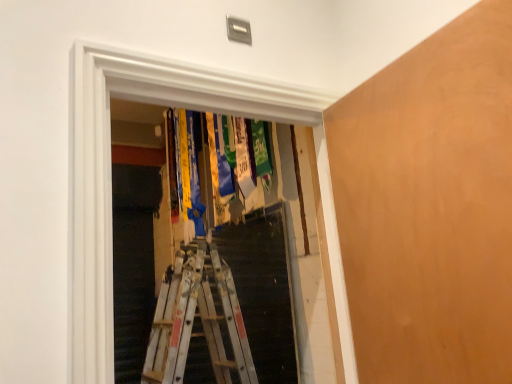
Question: From the image's perspective, is metallic silver ladder at center over transparent plastic medals at center?

Choices:
 (A) no
 (B) yes

Answer: (A)

Question: Is metallic silver ladder at center bigger than transparent plastic medals at center?

Choices:
 (A) no
 (B) yes

Answer: (A)

Question: Is metallic silver ladder at center facing away from transparent plastic medals at center?

Choices:
 (A) yes
 (B) no

Answer: (B)

Question: Does metallic silver ladder at center touch transparent plastic medals at center?

Choices:
 (A) yes
 (B) no

Answer: (B)

Question: From a real-world perspective, is metallic silver ladder at center positioned over transparent plastic medals at center based on gravity?

Choices:
 (A) no
 (B) yes

Answer: (A)

Question: Is metallic silver ladder at center oriented towards transparent plastic medals at center?

Choices:
 (A) yes
 (B) no

Answer: (B)

Question: Does smooth orange plywood at right have a lesser height compared to metallic silver ladder at center?

Choices:
 (A) no
 (B) yes

Answer: (B)

Question: Is smooth orange plywood at right beside metallic silver ladder at center?

Choices:
 (A) no
 (B) yes

Answer: (A)

Question: From a real-world perspective, is smooth orange plywood at right below metallic silver ladder at center?

Choices:
 (A) yes
 (B) no

Answer: (B)

Question: Is the position of smooth orange plywood at right more distant than that of metallic silver ladder at center?

Choices:
 (A) yes
 (B) no

Answer: (B)

Question: From the image's perspective, is smooth orange plywood at right over metallic silver ladder at center?

Choices:
 (A) yes
 (B) no

Answer: (A)

Question: Is the position of smooth orange plywood at right less distant than that of metallic silver ladder at center?

Choices:
 (A) no
 (B) yes

Answer: (B)

Question: Can you confirm if smooth orange plywood at right is taller than transparent plastic medals at center?

Choices:
 (A) yes
 (B) no

Answer: (B)